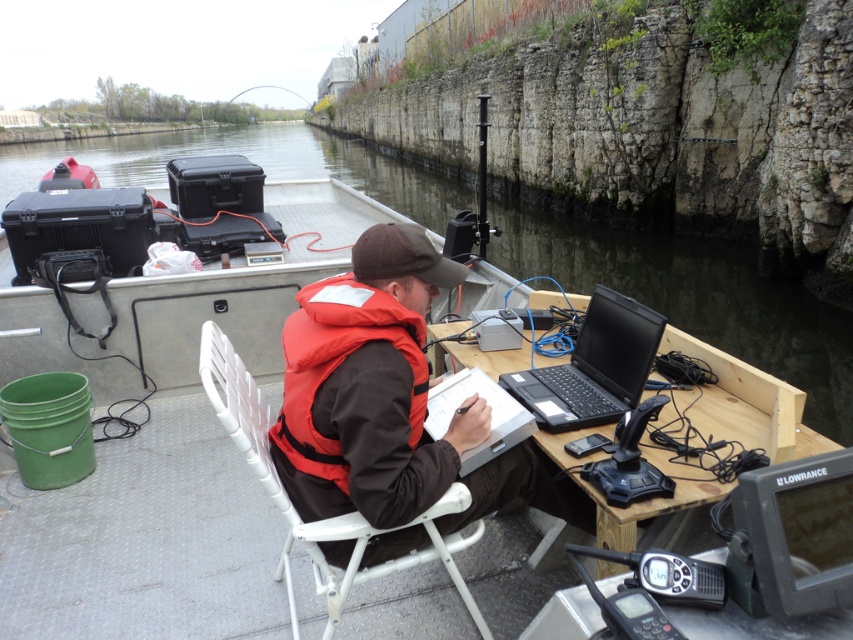
You are on a boat and need to store a large equipment box. The box is bigger than the white plastic chair at center. Will it fit in the space where the clear water at boat center is currently located?

The clear water at boat center is larger in size than the white plastic chair at center. Since the equipment box is bigger than the white plastic chair at center, it might fit in the space where the clear water is, as the water area is larger. However, since water can be displaced, the actual storage space may depend on how the water is contained or if the area can be dried and used for storage.